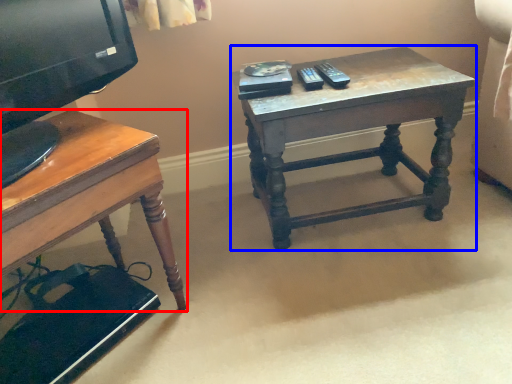
Question: Which of the following is the closest to the observer, desk (highlighted by a red box) or table (highlighted by a blue box)?

Choices:
 (A) desk
 (B) table

Answer: (A)